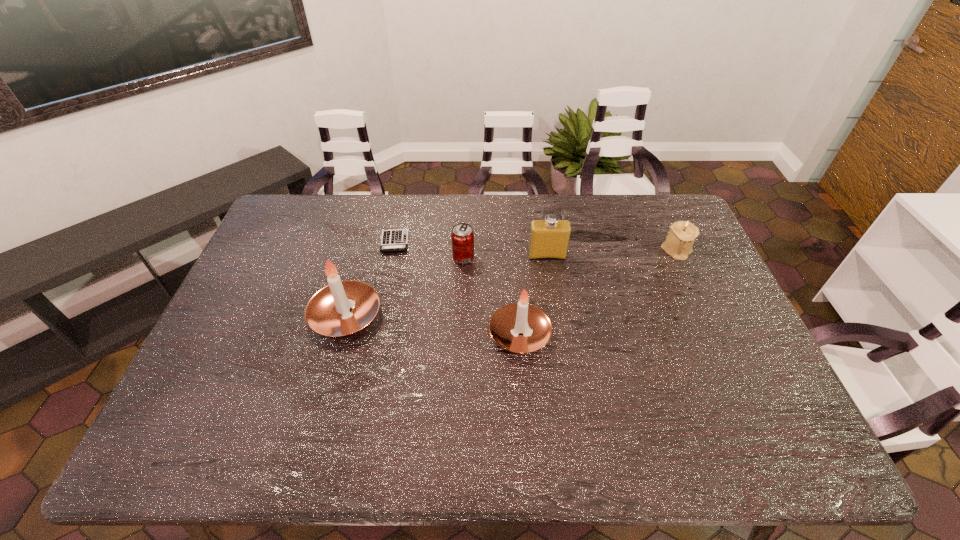
This screenshot has width=960, height=540. What are the coordinates of `the fifth closest object relative to the perfume` in the screenshot? It's located at (328, 313).

You are a GUI agent. You are given a task and a screenshot of the screen. Output one action in this format:
    pyautogui.click(x=<x>, y=<y>)
    Task: Click on the free point that satisfies the following two spatial constraints: 1. on the back side of the tallest object; 2. on the right side of the shortest object
    This screenshot has width=960, height=540.
    Given the screenshot: What is the action you would take?
    pyautogui.click(x=366, y=242)

The width and height of the screenshot is (960, 540). I want to click on vacant space that satisfies the following two spatial constraints: 1. on the front side of the tallest object; 2. on the right side of the shorter candle, so click(341, 334).